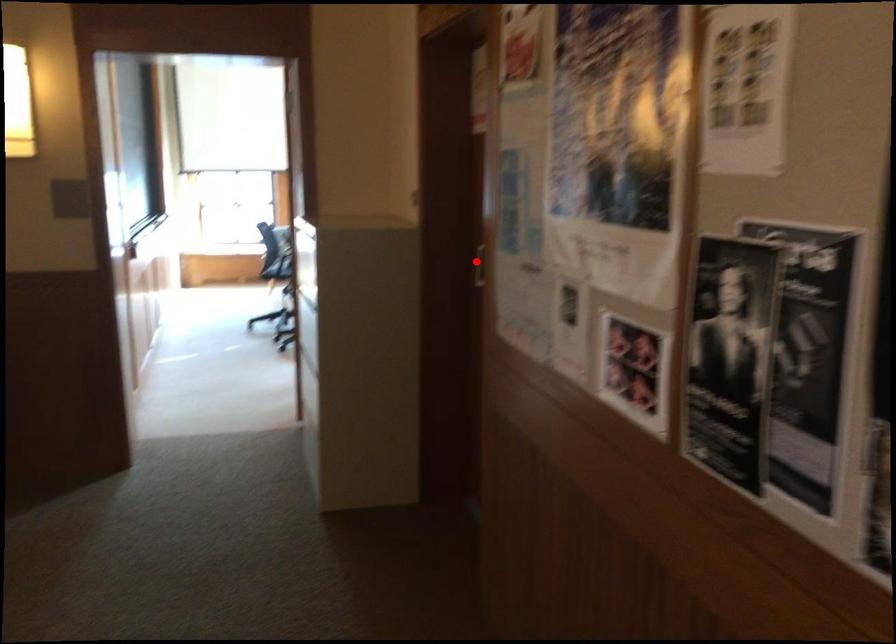
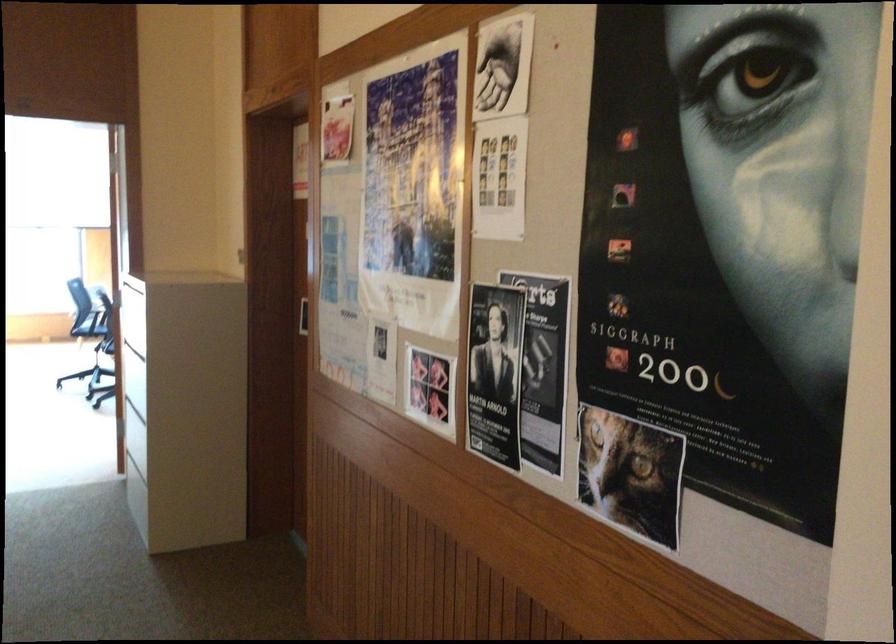
Locate, in the second image, the point that corresponds to the highlighted location in the first image.

(300, 315)